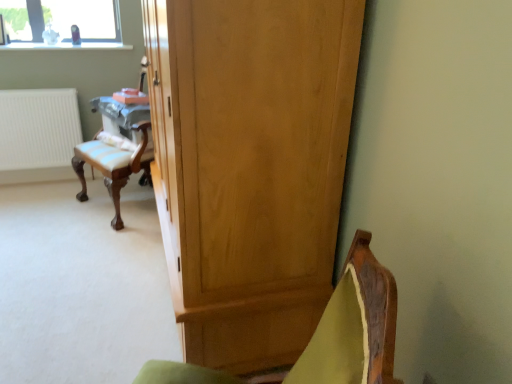
Question: Based on their sizes in the image, would you say velvet green chair at lower right is bigger or smaller than white matte radiator at left?

Choices:
 (A) small
 (B) big

Answer: (B)

Question: From the image's perspective, relative to white matte radiator at left, is velvet green chair at lower right above or below?

Choices:
 (A) below
 (B) above

Answer: (A)

Question: Estimate the real-world distances between objects in this image. Which object is farther from the light brown wood cupboard at center?

Choices:
 (A) velvet green chair at lower right
 (B) white matte radiator at left

Answer: (B)

Question: Estimate the real-world distances between objects in this image. Which object is farther from the light brown wood cupboard at center?

Choices:
 (A) white matte radiator at left
 (B) velvet green chair at lower right

Answer: (A)